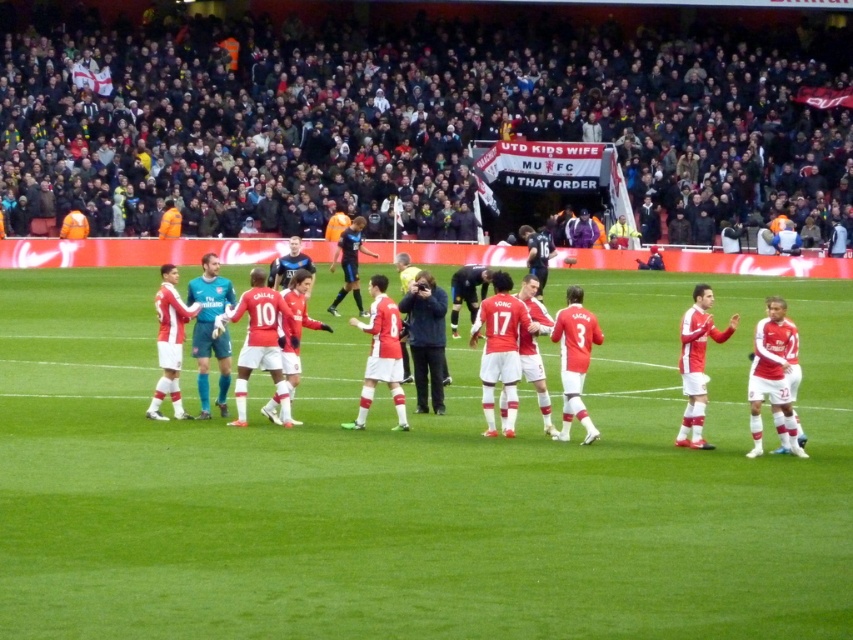
You are a photographer positioned at the origin point of the field. You want to capture a photo of the red matte soccer team at center. Which direction should you aim your camera to ensure the team is centered in your shot?

Since the red matte soccer team at center is located at coordinates point (775, 380), you should aim your camera towards the upper right direction from your current position at the origin to center them in the photo.

You are a photographer standing at the edge of the field. You want to take a photo that includes both the red matte soccer field at center and the dark blue jacket at center. Which object will appear larger in the photo?

The red matte soccer field at center will appear larger in the photo because it is closer to the viewer than the dark blue jacket at center.

You are a photographer positioned at the edge of the field. You need to capture a photo that includes both the red matte soccer field at center and the dark blue jacket at center. Based on their positions, which object should be placed on the right side of the photo to ensure both are visible?

The red matte soccer field at center should be placed on the right side of the photo since it is to the right of the dark blue jacket at center, ensuring both are visible in the frame.